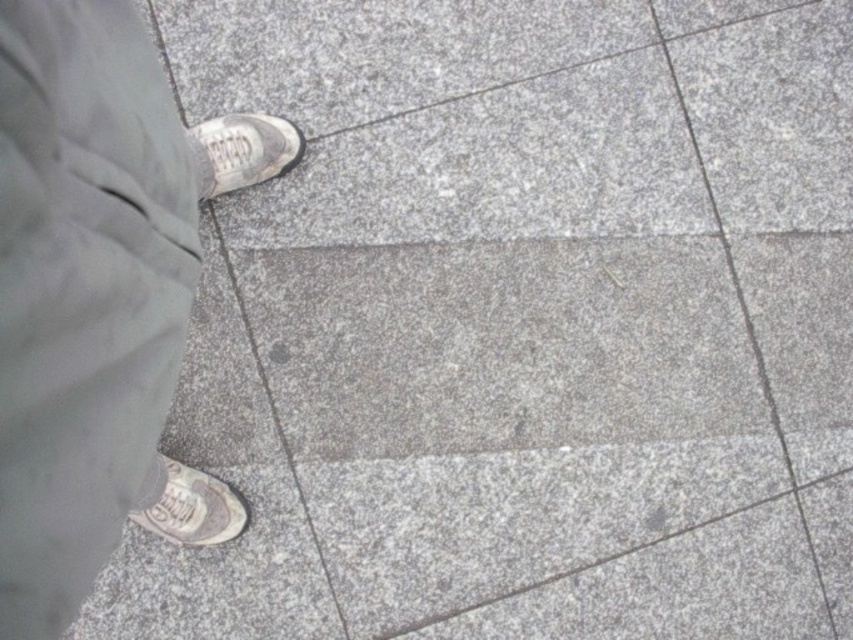
Question: Which point is farther to the camera?

Choices:
 (A) white canvas shoe at upper left
 (B) white leather shoe at lower left
 (C) matte gray pants at lower left

Answer: (A)

Question: Is matte gray pants at lower left positioned at the back of white canvas shoe at upper left?

Choices:
 (A) no
 (B) yes

Answer: (A)

Question: Which object appears closest to the camera in this image?

Choices:
 (A) white canvas shoe at upper left
 (B) matte gray pants at lower left
 (C) white leather shoe at lower left

Answer: (B)

Question: Which point is closer to the camera taking this photo?

Choices:
 (A) (215, 512)
 (B) (209, 147)
 (C) (15, 170)

Answer: (C)

Question: Is matte gray pants at lower left closer to camera compared to white leather shoe at lower left?

Choices:
 (A) yes
 (B) no

Answer: (A)

Question: Does white canvas shoe at upper left appear on the left side of white leather shoe at lower left?

Choices:
 (A) yes
 (B) no

Answer: (B)